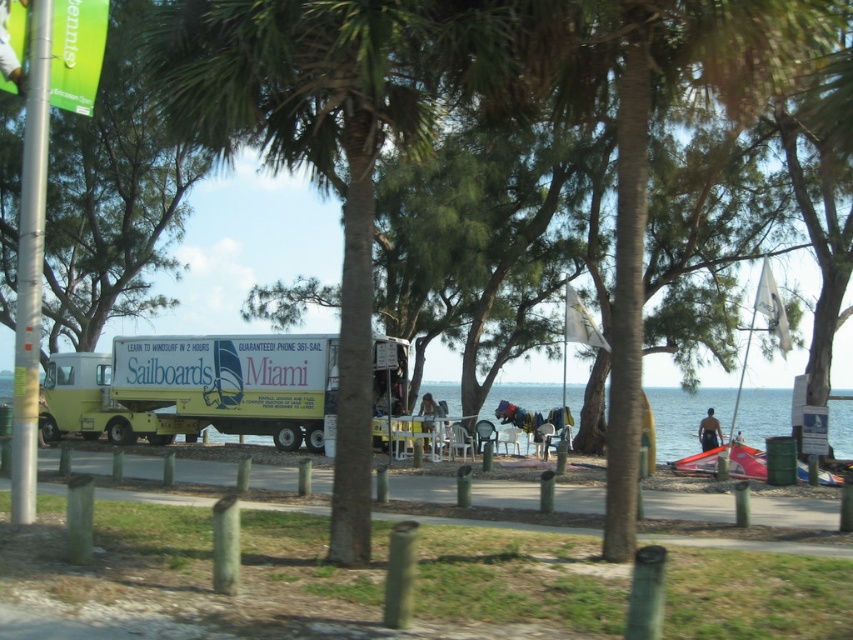
Question: Considering the relative positions of yellow matte food truck at center and clear blue water at lower center in the image provided, where is yellow matte food truck at center located with respect to clear blue water at lower center?

Choices:
 (A) left
 (B) right

Answer: (A)

Question: Does yellow matte food truck at center have a smaller size compared to yellow matte truck at left?

Choices:
 (A) no
 (B) yes

Answer: (A)

Question: Where is yellow matte food truck at center located in relation to clear blue water at lower center in the image?

Choices:
 (A) right
 (B) left

Answer: (B)

Question: Estimate the real-world distances between objects in this image. Which object is closer to the yellow matte truck at left?

Choices:
 (A) clear blue water at lower center
 (B) yellow matte food truck at center

Answer: (B)

Question: Among these points, which one is nearest to the camera?

Choices:
 (A) (231, 401)
 (B) (688, 436)
 (C) (51, 436)

Answer: (A)

Question: Estimate the real-world distances between objects in this image. Which object is closer to the yellow matte truck at left?

Choices:
 (A) yellow matte food truck at center
 (B) clear blue water at lower center

Answer: (A)